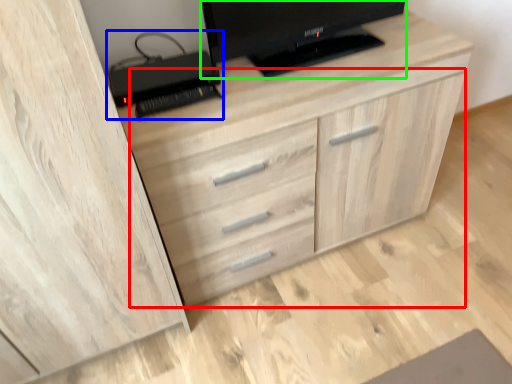
Question: Based on their relative distances, which object is farther from dresser (highlighted by a red box)? Choose from computer (highlighted by a blue box) and television (highlighted by a green box).

Choices:
 (A) computer
 (B) television

Answer: (A)